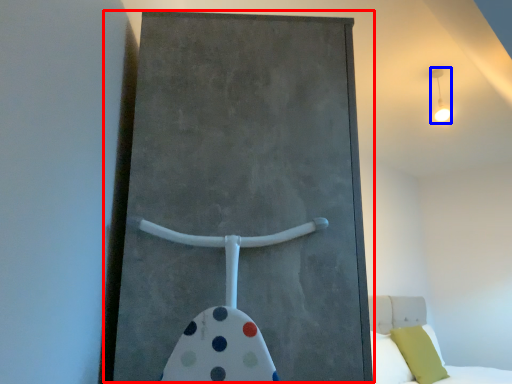
Question: Among these objects, which one is farthest to the camera, barn door (highlighted by a red box) or light fixture (highlighted by a blue box)?

Choices:
 (A) barn door
 (B) light fixture

Answer: (B)